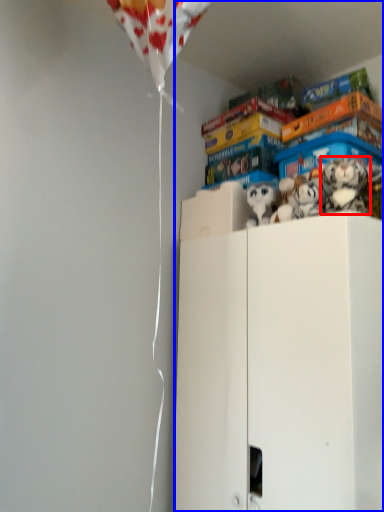
Question: Among these objects, which one is farthest to the camera, toy (highlighted by a red box) or cabinetry (highlighted by a blue box)?

Choices:
 (A) toy
 (B) cabinetry

Answer: (A)